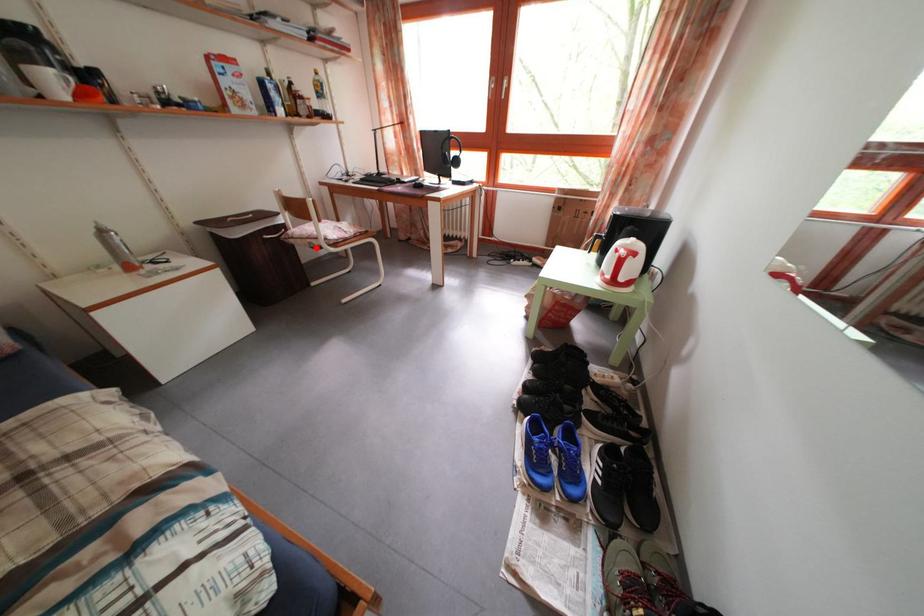
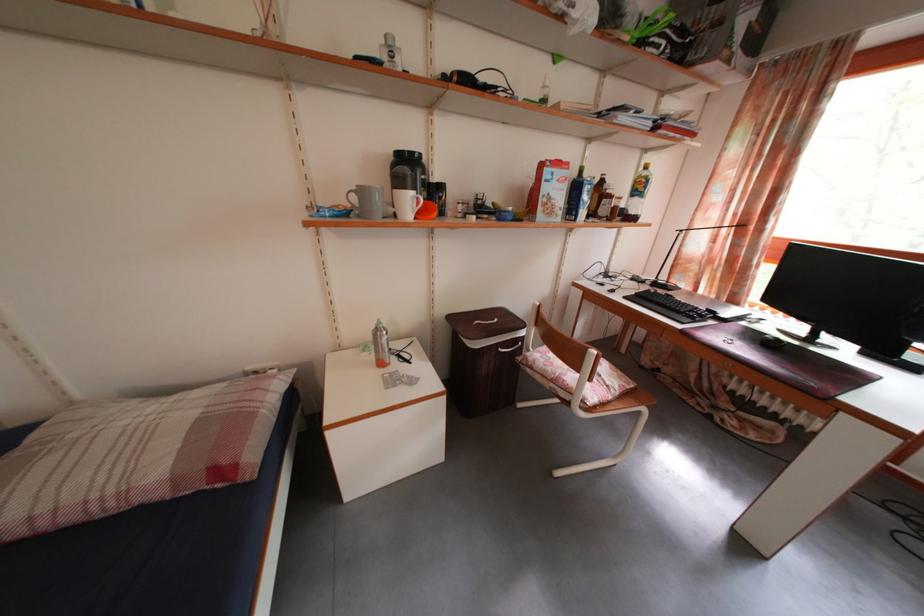
Find the pixel in the second image that matches the highlighted location in the first image.

(560, 392)